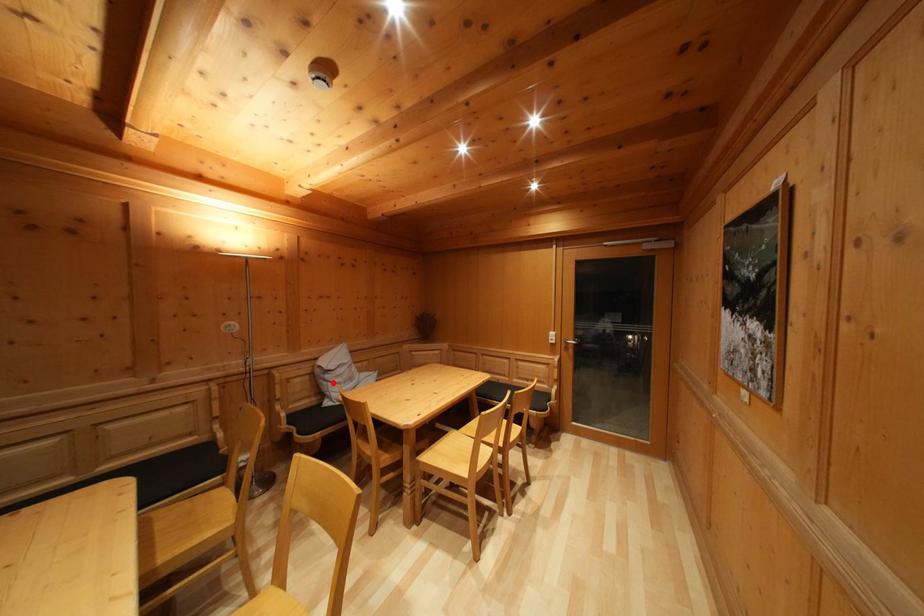
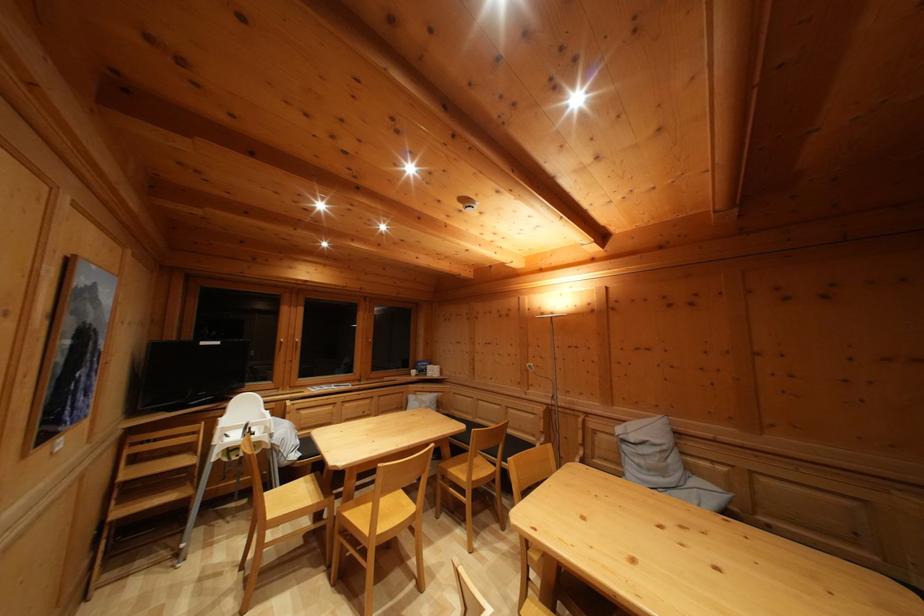
Question: I am providing you with two images of the same scene from different viewpoints. A red point is shown in image1. For the corresponding object point in image2, is it positioned nearer or farther from the camera?

Choices:
 (A) Nearer
 (B) Farther

Answer: (B)